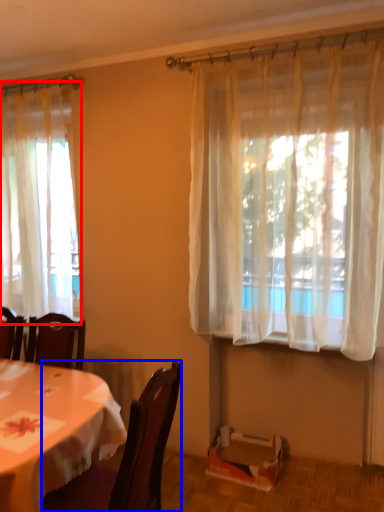
Question: Which of the following is the farthest to the observer, curtain (highlighted by a red box) or chair (highlighted by a blue box)?

Choices:
 (A) curtain
 (B) chair

Answer: (A)